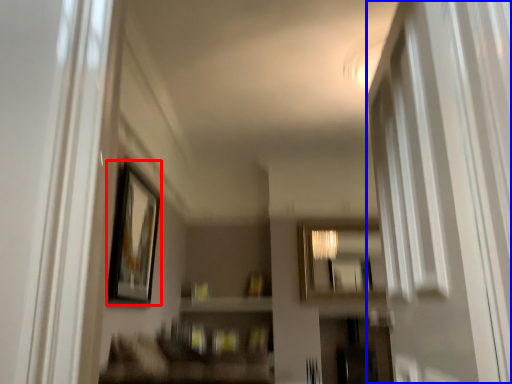
Question: Which of the following is the closest to the observer, picture frame (highlighted by a red box) or screen door (highlighted by a blue box)?

Choices:
 (A) picture frame
 (B) screen door

Answer: (B)